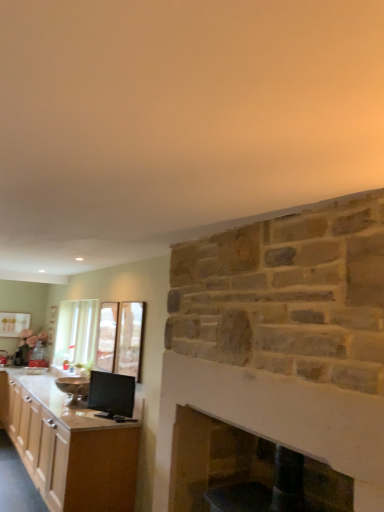
Question: Based on their sizes in the image, would you say matte black monitor at lower left, acting as the first appliance starting from the right, is bigger or smaller than clear glass door at upper center, the 2th glass door viewed from the left?

Choices:
 (A) small
 (B) big

Answer: (B)

Question: In terms of height, does matte black monitor at lower left, positioned as the 2th appliance in left-to-right order, look taller or shorter compared to clear glass door at upper center, which appears as the first glass door when viewed from the front?

Choices:
 (A) short
 (B) tall

Answer: (A)

Question: Estimate the real-world distances between objects in this image. Which object is farther from the clear glass door at upper center, placed as the 2th glass door when sorted from back to front?

Choices:
 (A) metallic silver bowl at left, placed as the second appliance when sorted from right to left
 (B) matte black monitor at lower left, acting as the first appliance starting from the right
 (C) wooden cabinet at left
 (D) smooth stone fireplace at center
 (E) clear glass door at center, which is the first glass door from left to right

Answer: (D)

Question: Which object is positioned farthest from the matte black monitor at lower left, acting as the first appliance starting from the right?

Choices:
 (A) metallic silver bowl at left, the second appliance viewed from the front
 (B) clear glass door at center, which is the first glass door from back to front
 (C) smooth stone fireplace at center
 (D) clear glass door at upper center, acting as the first glass door starting from the right
 (E) wooden cabinet at left

Answer: (C)